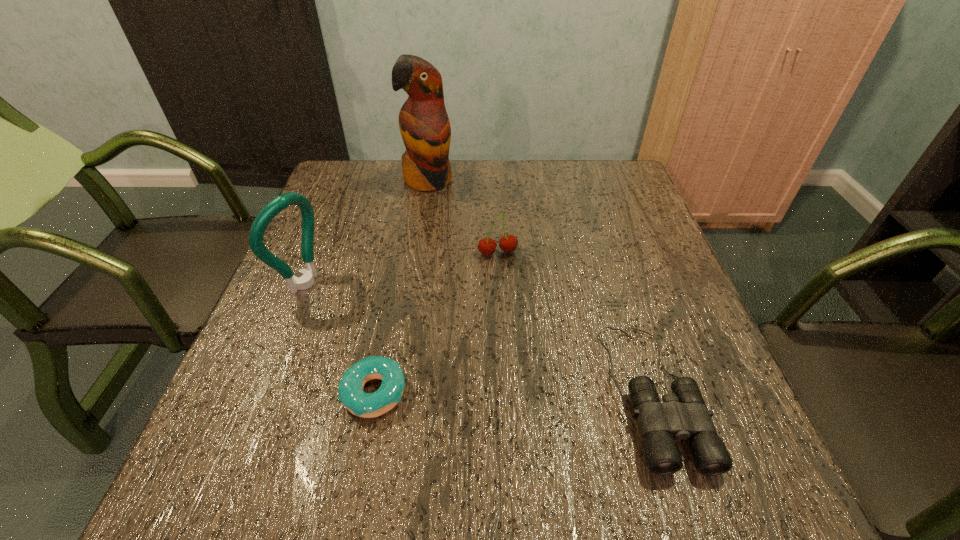
The height and width of the screenshot is (540, 960). In order to click on free spot at the near left corner of the desktop in this screenshot , I will do coord(238,409).

In the image, there is a desktop. In order to click on blank space at the far right corner in this screenshot , I will do `click(612, 176)`.

Identify the location of free space at the near right corner. The height and width of the screenshot is (540, 960). (737, 426).

Find the location of a particular element. unoccupied area between the doughnut and the rightmost object is located at coordinates (514, 392).

The width and height of the screenshot is (960, 540). What are the coordinates of `free space between the third shortest object and the doughnut` in the screenshot? It's located at (436, 322).

Locate an element on the screen. empty space between the fourth tallest object and the third farthest object is located at coordinates (478, 338).

Where is `free spot between the fourth shortest object and the tallest object`? The height and width of the screenshot is (540, 960). free spot between the fourth shortest object and the tallest object is located at coordinates (367, 232).

Where is `vacant area that lies between the doughnut and the tallest object`? This screenshot has height=540, width=960. vacant area that lies between the doughnut and the tallest object is located at coordinates (401, 286).

This screenshot has height=540, width=960. I want to click on empty space between the shortest object and the leftmost object, so click(340, 338).

At what (x,y) coordinates should I click in order to perform the action: click on empty space between the parrot and the shortest object. Please return your answer as a coordinate pair (x, y). Looking at the image, I should click on (x=401, y=286).